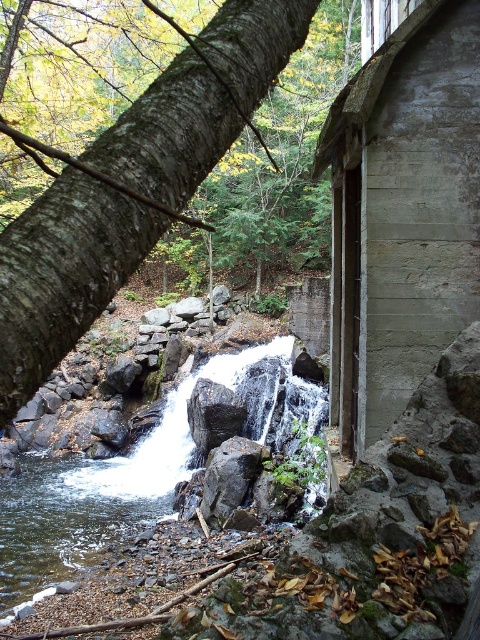
Question: Which object is the farthest from the smooth gray rock at center?

Choices:
 (A) clear water at center
 (B) concrete wall at right
 (C) smooth brown tree trunk at upper left
 (D) gray rough rock at center

Answer: (C)

Question: Which object is positioned closest to the smooth gray rock at center?

Choices:
 (A) white smooth water at center
 (B) concrete wall at right
 (C) clear water at center

Answer: (C)

Question: Does smooth brown tree trunk at upper left have a lesser width compared to gray rough rock at center?

Choices:
 (A) no
 (B) yes

Answer: (B)

Question: Which of the following is the farthest from the observer?

Choices:
 (A) smooth brown tree trunk at upper left
 (B) smooth gray rock at center
 (C) clear water at center
 (D) gray rough rock at center

Answer: (D)

Question: Can you confirm if white smooth water at center is positioned to the right of clear water at center?

Choices:
 (A) yes
 (B) no

Answer: (A)

Question: Observing the image, what is the correct spatial positioning of smooth brown tree trunk at upper left in reference to clear water at center?

Choices:
 (A) above
 (B) below

Answer: (A)